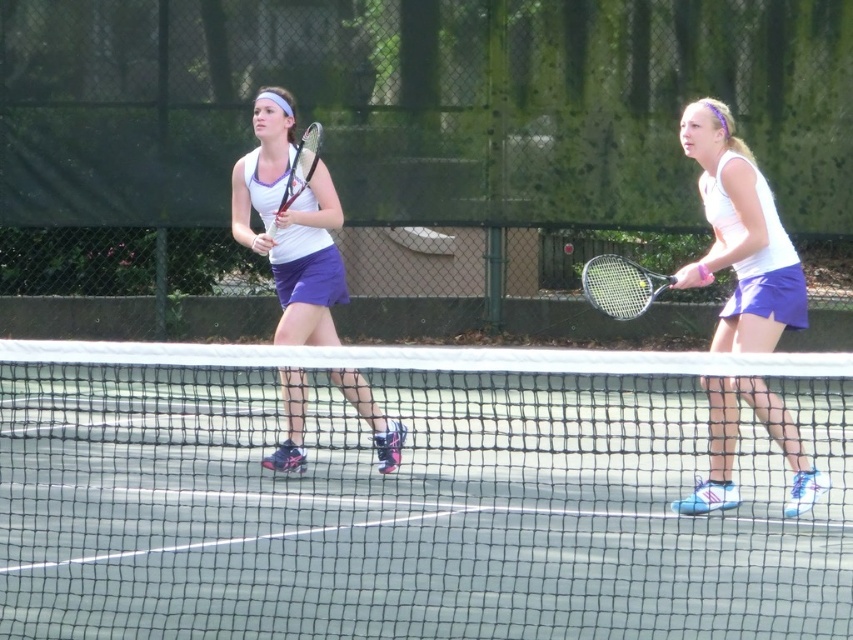
Is white mesh net at center wider than white matte tennis racket at right?

Incorrect, white mesh net at center's width does not surpass white matte tennis racket at right's.

Can you confirm if white mesh net at center is thinner than white matte tennis racket at right?

Indeed, white mesh net at center has a lesser width compared to white matte tennis racket at right.

The height and width of the screenshot is (640, 853). Identify the location of white mesh net at center. (410, 497).

Is point (746, 204) behind point (305, 170)?

No, (746, 204) is in front of (305, 170).

Can you confirm if white matte tennis racket at right is bigger than white matte tennis racket at center?

Yes, white matte tennis racket at right is bigger than white matte tennis racket at center.

Is point (708, 257) closer to viewer compared to point (318, 138)?

Yes, point (708, 257) is in front of point (318, 138).

Find the location of a particular element. The image size is (853, 640). white matte tennis racket at right is located at coordinates (740, 236).

Is point (596, 291) positioned in front of point (299, 164)?

That is True.

Does black matte tennis racket at right have a lesser width compared to white matte tennis racket at center?

In fact, black matte tennis racket at right might be wider than white matte tennis racket at center.

Does point (602, 307) come farther from viewer compared to point (299, 177)?

No, it is not.

Image resolution: width=853 pixels, height=640 pixels. Find the location of `black matte tennis racket at right`. black matte tennis racket at right is located at coordinates (621, 285).